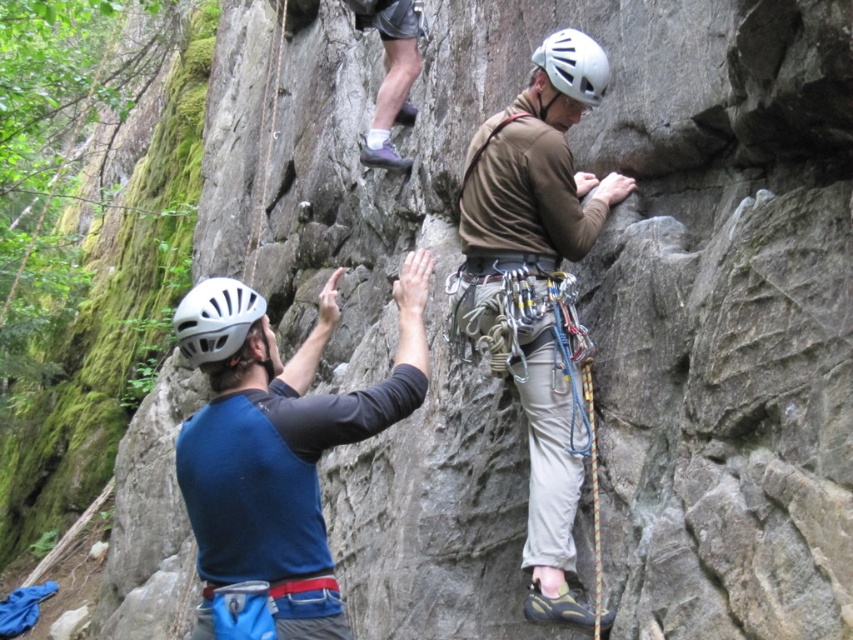
Does white matte helmet at center appear under rope at upper center?

Yes.

Who is positioned more to the right, white matte helmet at center or rope at upper center?

white matte helmet at center is more to the right.

What do you see at coordinates (215, 320) in the screenshot?
I see `white matte helmet at center` at bounding box center [215, 320].

This screenshot has width=853, height=640. I want to click on white matte helmet at center, so click(215, 320).

Measure the distance from matte brown shirt at center to blue fabric shirt at center.

A distance of 10.66 feet exists between matte brown shirt at center and blue fabric shirt at center.

Is matte brown shirt at center taller than blue fabric shirt at center?

Indeed, matte brown shirt at center has a greater height compared to blue fabric shirt at center.

Locate an element on the screen. This screenshot has height=640, width=853. matte brown shirt at center is located at coordinates (538, 292).

Locate an element on the screen. matte brown shirt at center is located at coordinates (538, 292).

This screenshot has height=640, width=853. What do you see at coordinates (573, 65) in the screenshot?
I see `white matte helmet at upper center` at bounding box center [573, 65].

Which is in front, point (558, 81) or point (273, 104)?

Positioned in front is point (558, 81).

Which is behind, point (583, 60) or point (268, 108)?

The point (268, 108) is more distant.

This screenshot has height=640, width=853. I want to click on white matte helmet at upper center, so click(x=573, y=65).